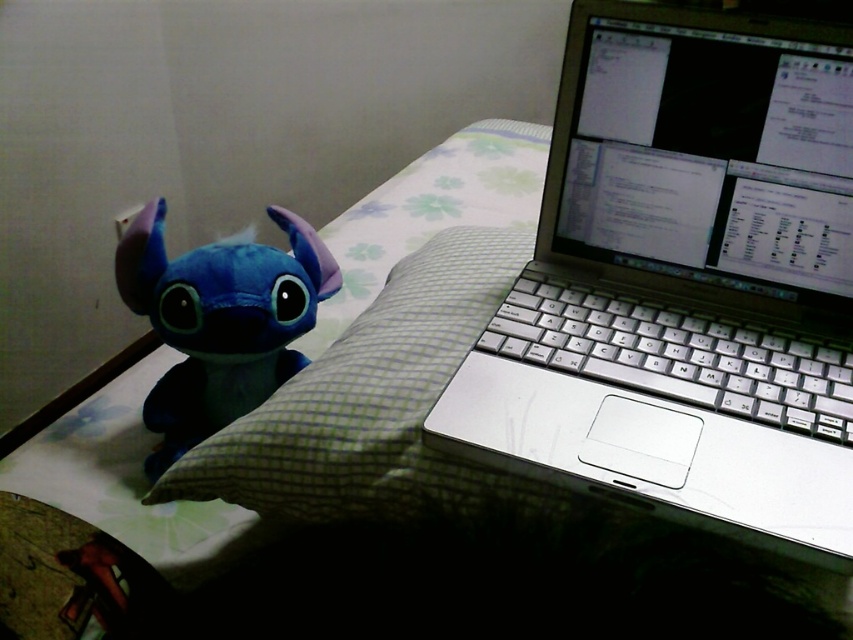
Question: Which of the following is the farthest from the observer?

Choices:
 (A) silver metallic laptop at upper right
 (B) soft blue plush at left

Answer: (B)

Question: Is silver metallic laptop at upper right smaller than soft blue plush at left?

Choices:
 (A) yes
 (B) no

Answer: (B)

Question: Does silver metallic laptop at upper right appear on the right side of soft blue plush at left?

Choices:
 (A) yes
 (B) no

Answer: (A)

Question: Is silver metallic laptop at upper right below soft blue plush at left?

Choices:
 (A) no
 (B) yes

Answer: (A)

Question: Among these objects, which one is nearest to the camera?

Choices:
 (A) silver metallic laptop at upper right
 (B) soft blue plush at left

Answer: (A)